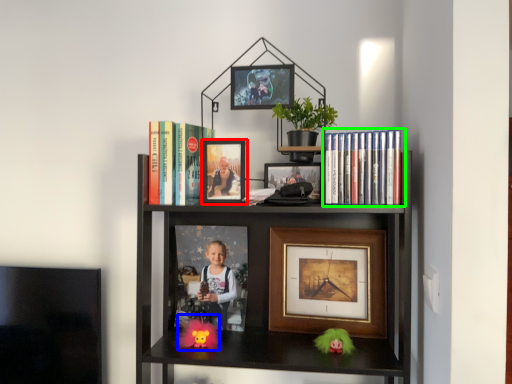
Question: Which object is positioned closest to picture frame (highlighted by a red box)? Select from toy (highlighted by a blue box) and book (highlighted by a green box).

Choices:
 (A) toy
 (B) book

Answer: (B)